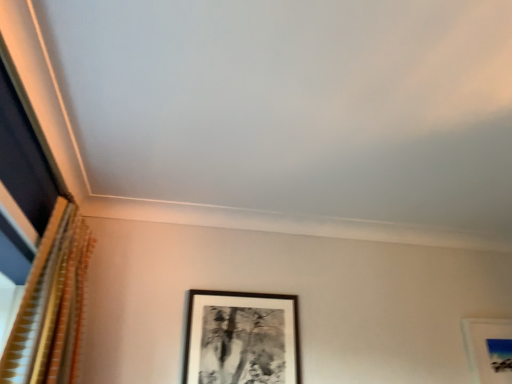
Question: Is gold textured curtain at left further to the viewer compared to black matte picture frame at center?

Choices:
 (A) yes
 (B) no

Answer: (B)

Question: Is gold textured curtain at left smaller than black matte picture frame at center?

Choices:
 (A) yes
 (B) no

Answer: (B)

Question: From the image's perspective, is gold textured curtain at left on top of black matte picture frame at center?

Choices:
 (A) yes
 (B) no

Answer: (A)

Question: Does gold textured curtain at left appear on the right side of black matte picture frame at center?

Choices:
 (A) no
 (B) yes

Answer: (A)

Question: Is gold textured curtain at left not close to black matte picture frame at center?

Choices:
 (A) yes
 (B) no

Answer: (B)

Question: From a real-world perspective, is gold textured curtain at left located beneath black matte picture frame at center?

Choices:
 (A) yes
 (B) no

Answer: (B)

Question: Is black matte picture frame at center at the right side of gold textured curtain at left?

Choices:
 (A) no
 (B) yes

Answer: (B)

Question: Does black matte picture frame at center have a larger size compared to gold textured curtain at left?

Choices:
 (A) no
 (B) yes

Answer: (A)

Question: Considering the relative sizes of black matte picture frame at center and gold textured curtain at left in the image provided, is black matte picture frame at center taller than gold textured curtain at left?

Choices:
 (A) no
 (B) yes

Answer: (A)

Question: From a real-world perspective, is black matte picture frame at center located beneath gold textured curtain at left?

Choices:
 (A) yes
 (B) no

Answer: (A)

Question: Is black matte picture frame at center directly adjacent to gold textured curtain at left?

Choices:
 (A) no
 (B) yes

Answer: (A)

Question: Is black matte picture frame at center turned away from gold textured curtain at left?

Choices:
 (A) yes
 (B) no

Answer: (B)

Question: Is gold textured curtain at left spatially inside black matte picture frame at center, or outside of it?

Choices:
 (A) inside
 (B) outside

Answer: (B)